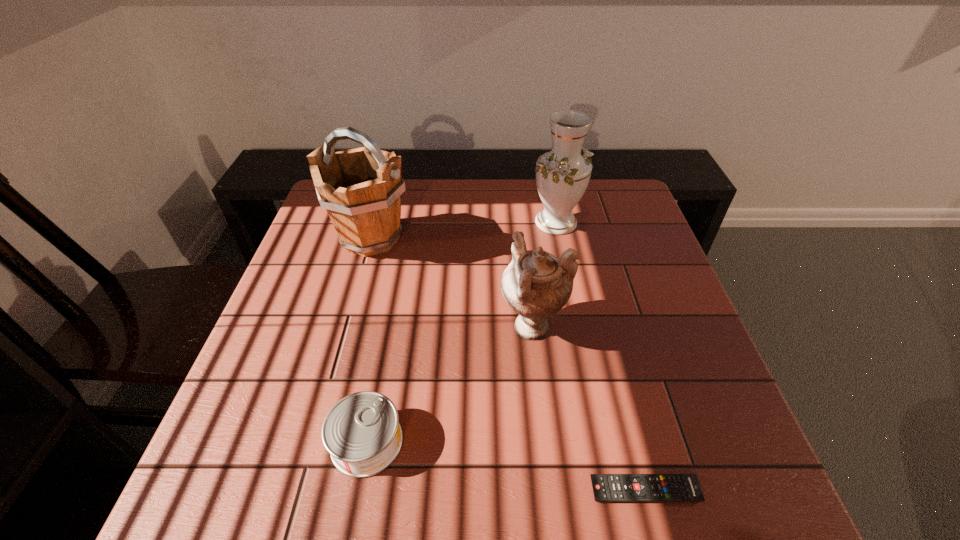
At what (x,y) coordinates should I click in order to perform the action: click on empty location between the bucket and the vase. Please return your answer as a coordinate pair (x, y). This screenshot has width=960, height=540. Looking at the image, I should click on (464, 230).

Where is `vacant space that is in between the can and the shortest object`? vacant space that is in between the can and the shortest object is located at coordinates (506, 466).

Identify the location of empty space between the shortest object and the can. (506, 466).

Locate an element on the screen. Image resolution: width=960 pixels, height=540 pixels. free space between the can and the urn is located at coordinates (450, 384).

Select which object is the fourth closest to the second shortest object. Please provide its 2D coordinates. Your answer should be formatted as a tuple, i.e. [(x, y)], where the tuple contains the x and y coordinates of a point satisfying the conditions above.

[(562, 175)]

Where is `the fourth closest object to the third tallest object`? The height and width of the screenshot is (540, 960). the fourth closest object to the third tallest object is located at coordinates (361, 188).

Where is `free space in the image that satisfies the following two spatial constraints: 1. on the front side of the fourth tallest object; 2. on the right side of the remote control`? free space in the image that satisfies the following two spatial constraints: 1. on the front side of the fourth tallest object; 2. on the right side of the remote control is located at coordinates (357, 490).

This screenshot has height=540, width=960. What are the coordinates of `vacant space that satisfies the following two spatial constraints: 1. on the front side of the shortest object; 2. on the right side of the third shortest object` in the screenshot? It's located at (551, 490).

You are a GUI agent. You are given a task and a screenshot of the screen. Output one action in this format:
    pyautogui.click(x=<x>, y=<y>)
    Task: Click on the free point that satisfies the following two spatial constraints: 1. on the front side of the can; 2. on the left side of the shortest object
    This screenshot has height=540, width=960.
    Given the screenshot: What is the action you would take?
    pyautogui.click(x=357, y=490)